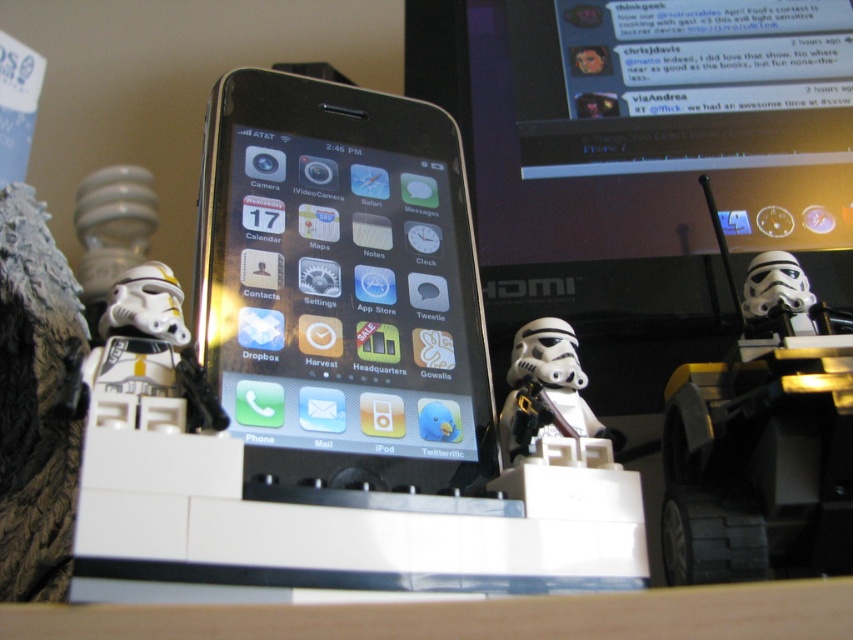
You are looking at the smartphone and LEGO setup. There are two points marked in the image. Which point is closer to you, point (328, 237) or point (508, 420)?

Point (328, 237) is closer to you than point (508, 420).

You are setting up a display for a Star Wars fan event. You have a black glossy smartphone at center and a white matte stormtrooper helmet at center. Based on the scene, which object is positioned to the right side of the display?

The white matte stormtrooper helmet at center is positioned to the right side of the display because the black glossy smartphone at center is to the left of it.